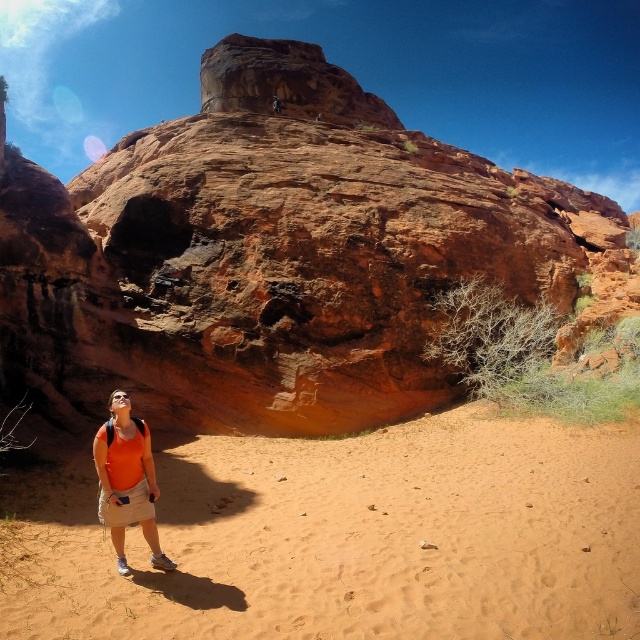
Is sandy orange sand at lower center shorter than orange fabric vest at lower left?

In fact, sandy orange sand at lower center may be taller than orange fabric vest at lower left.

Measure the distance between sandy orange sand at lower center and orange fabric vest at lower left.

They are 17.94 meters apart.

Where is `sandy orange sand at lower center`? This screenshot has width=640, height=640. sandy orange sand at lower center is located at coordinates click(x=356, y=538).

You are a GUI agent. You are given a task and a screenshot of the screen. Output one action in this format:
    pyautogui.click(x=<x>, y=<y>)
    Task: Click on the sandy orange sand at lower center
    Image resolution: width=640 pixels, height=640 pixels.
    Given the screenshot: What is the action you would take?
    pyautogui.click(x=356, y=538)

The height and width of the screenshot is (640, 640). What do you see at coordinates (356, 538) in the screenshot? I see `sandy orange sand at lower center` at bounding box center [356, 538].

Between sandy orange sand at lower center and orange fabric shirt at lower left, which one is positioned higher?

orange fabric shirt at lower left

Locate an element on the screen. The width and height of the screenshot is (640, 640). sandy orange sand at lower center is located at coordinates (356, 538).

Who is lower down, orange fabric shirt at lower left or orange fabric vest at lower left?

orange fabric shirt at lower left

Is the position of orange fabric shirt at lower left less distant than that of orange fabric vest at lower left?

Yes, orange fabric shirt at lower left is closer to the viewer.

The image size is (640, 640). What do you see at coordinates (125, 481) in the screenshot?
I see `orange fabric shirt at lower left` at bounding box center [125, 481].

Image resolution: width=640 pixels, height=640 pixels. Identify the location of orange fabric shirt at lower left. (125, 481).